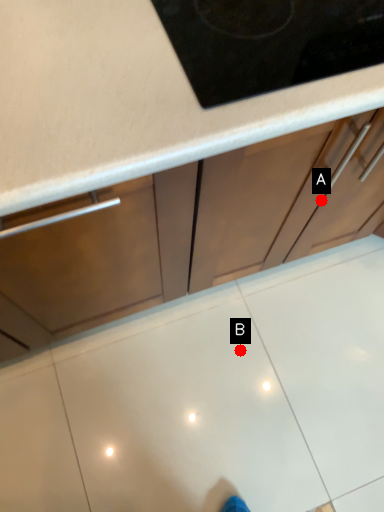
Question: Two points are circled on the image, labeled by A and B beside each circle. Which point is closer to the camera?

Choices:
 (A) A is closer
 (B) B is closer

Answer: (A)